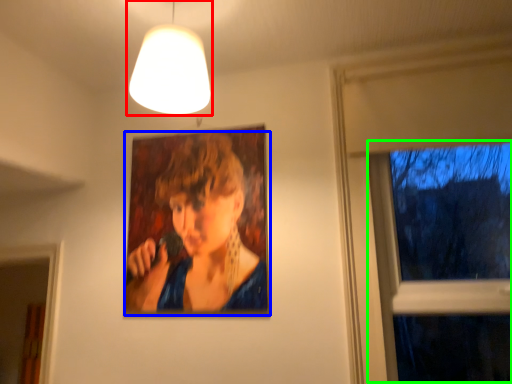
Question: Which is farther away from lamp (highlighted by a red box)? person (highlighted by a blue box) or window (highlighted by a green box)?

Choices:
 (A) person
 (B) window

Answer: (B)